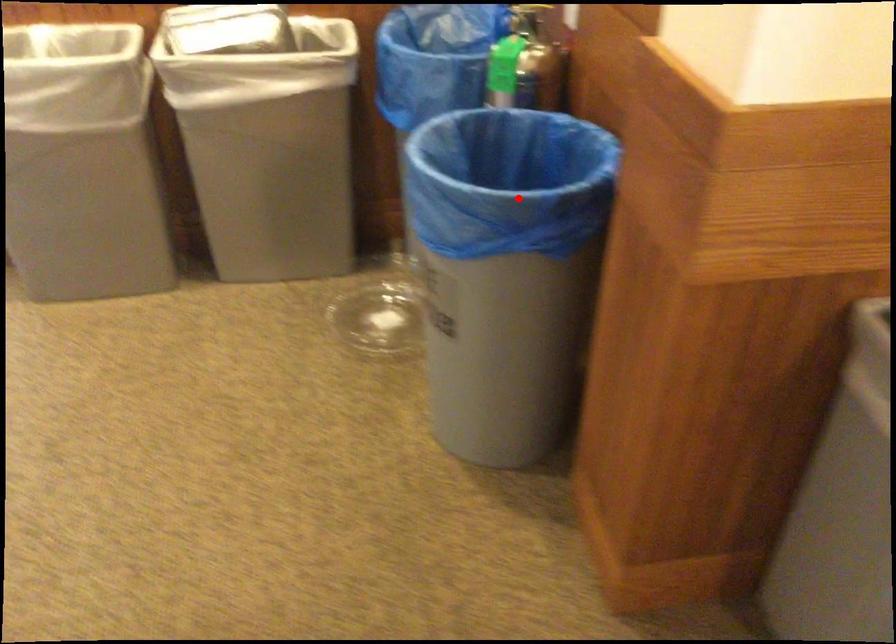
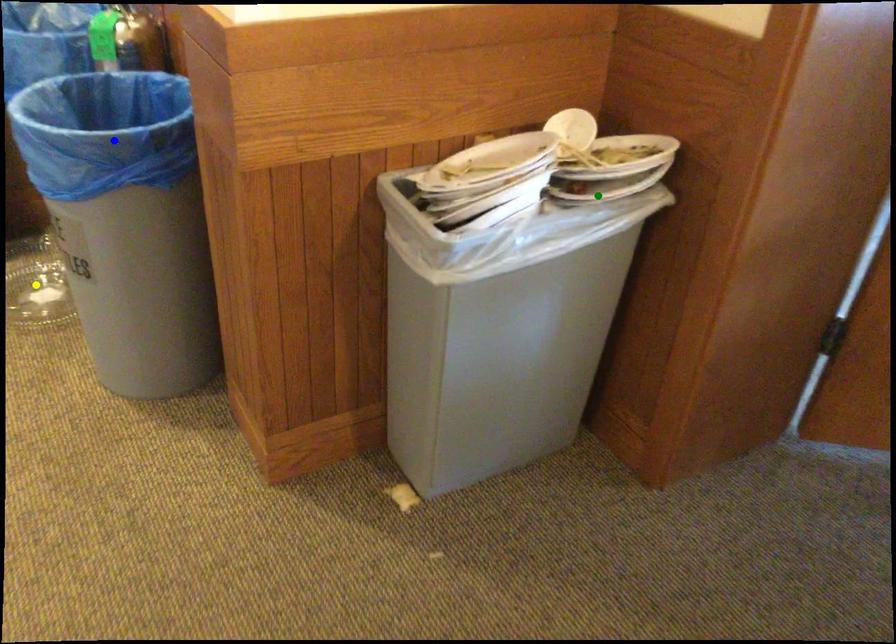
Question: I am providing you with two images of the same scene from different viewpoints. A red point is marked on the first image. You are given multiple points on the second image. Which mark in image 2 goes with the point in image 1?

Choices:
 (A) green point
 (B) blue point
 (C) yellow point

Answer: (B)